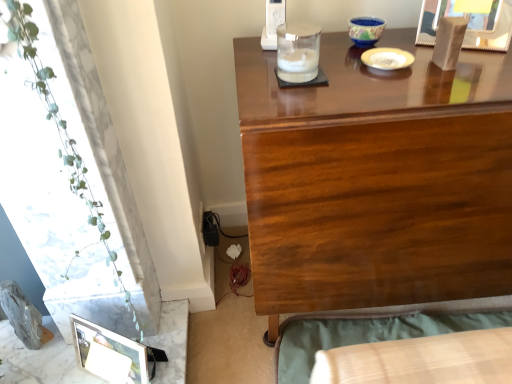
Locate an element on the screen. The height and width of the screenshot is (384, 512). vacant space behind clear glass candle holder at upper center, acting as the 2th candle holder starting from the top is located at coordinates (274, 48).